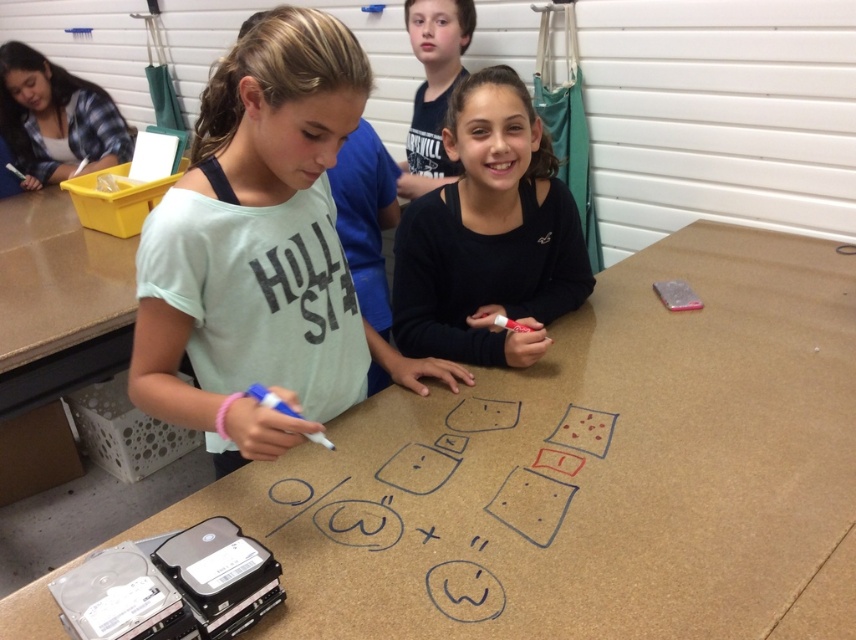
Based on the photo, does brown matte table at center appear on the left side of light green cotton shirt at center?

Incorrect, brown matte table at center is not on the left side of light green cotton shirt at center.

Is brown matte table at center positioned before light green cotton shirt at center?

Yes, brown matte table at center is in front of light green cotton shirt at center.

Does point (358, 532) lie behind point (290, 301)?

No.

The width and height of the screenshot is (856, 640). I want to click on brown matte table at center, so coord(592,472).

Does point (337, 266) lie in front of point (559, 209)?

Yes, it is in front of point (559, 209).

Is light green cotton shirt at center further to camera compared to black matte shirt at center?

No, light green cotton shirt at center is closer to the viewer.

What do you see at coordinates (262, 252) in the screenshot? I see `light green cotton shirt at center` at bounding box center [262, 252].

Identify the location of light green cotton shirt at center. (262, 252).

Between point (779, 518) and point (421, 340), which one is positioned in front?

Point (779, 518) is in front.

Between brown matte table at center and black matte shirt at center, which one appears on the left side from the viewer's perspective?

black matte shirt at center

Image resolution: width=856 pixels, height=640 pixels. Find the location of `brown matte table at center`. brown matte table at center is located at coordinates (592, 472).

The width and height of the screenshot is (856, 640). What are the coordinates of `brown matte table at center` in the screenshot? It's located at click(x=592, y=472).